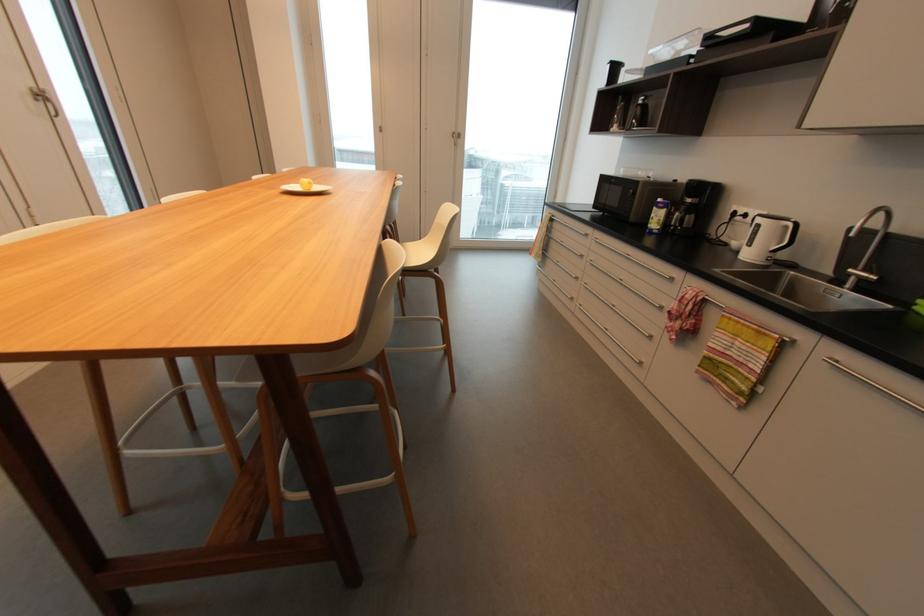
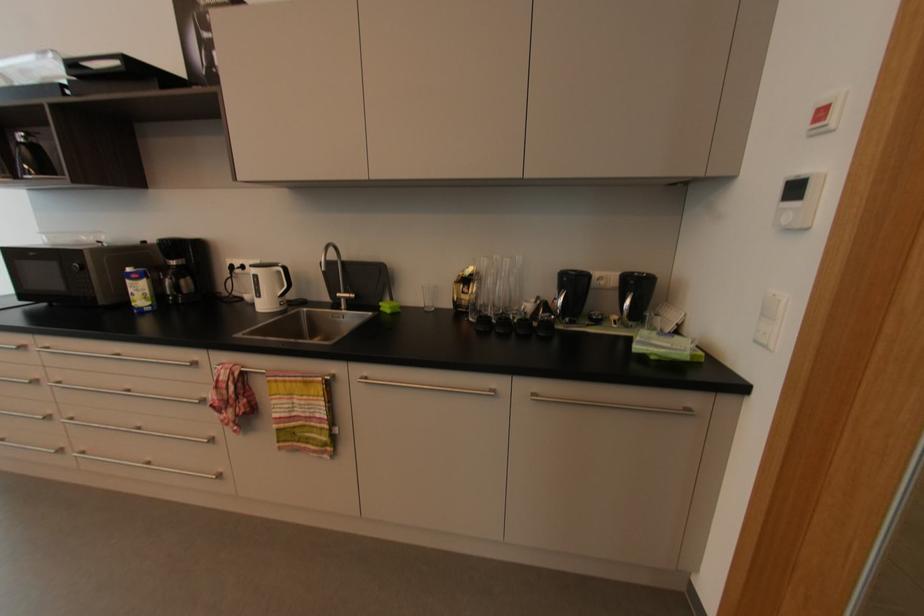
The point at (829, 361) is marked in the first image. Where is the corresponding point in the second image?

(362, 382)